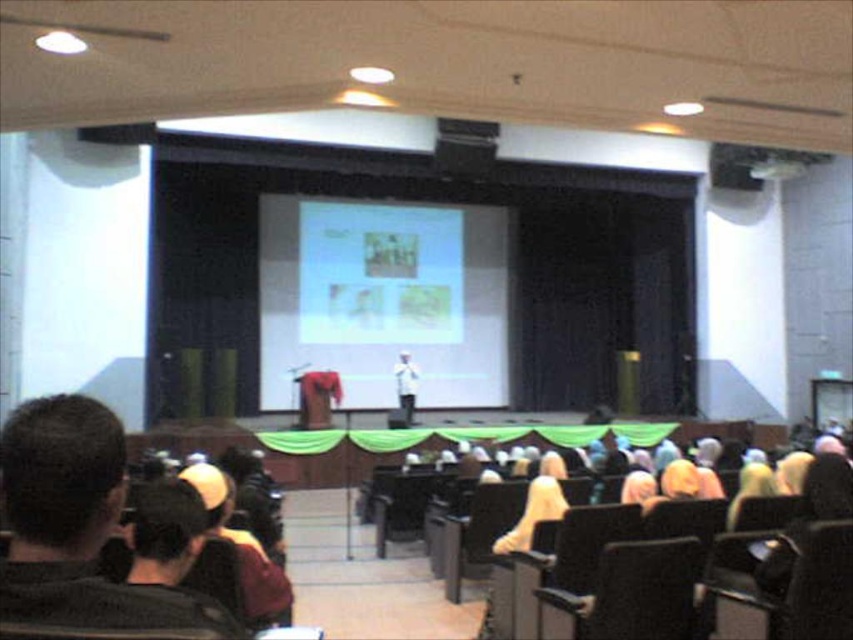
Question: Is white fabric at center below metallic projector at upper right?

Choices:
 (A) yes
 (B) no

Answer: (A)

Question: Considering the real-world distances, which object is farthest from the dark brown hair at lower left?

Choices:
 (A) white fabric at center
 (B) metallic projector at upper right
 (C) white glossy screen at center

Answer: (C)

Question: Can you confirm if white fabric at center is wider than metallic projector at upper right?

Choices:
 (A) yes
 (B) no

Answer: (B)

Question: Is dark brown hair at lower left below metallic projector at upper right?

Choices:
 (A) no
 (B) yes

Answer: (B)

Question: Which object is farther from the camera taking this photo?

Choices:
 (A) metallic projector at upper right
 (B) white fabric at center
 (C) white glossy screen at center
 (D) dark brown hair at lower left

Answer: (C)

Question: Estimate the real-world distances between objects in this image. Which object is closer to the white glossy screen at center?

Choices:
 (A) white fabric at center
 (B) dark brown hair at lower left

Answer: (A)